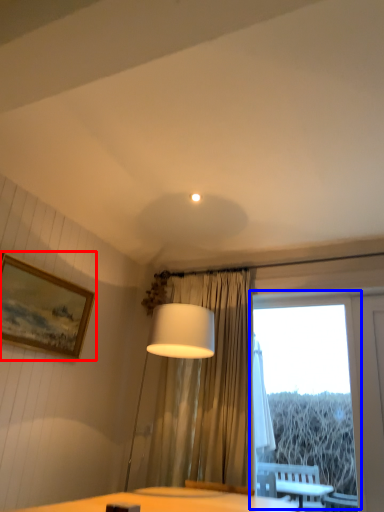
Question: Among these objects, which one is nearest to the camera, picture frame (highlighted by a red box) or window (highlighted by a blue box)?

Choices:
 (A) picture frame
 (B) window

Answer: (A)